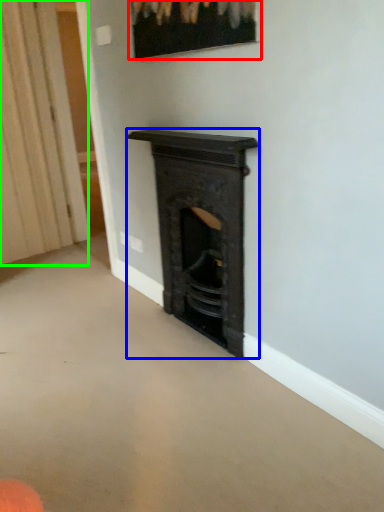
Question: Which is farther away from picture frame (highlighted by a red box)? fireplace (highlighted by a blue box) or curtain (highlighted by a green box)?

Choices:
 (A) fireplace
 (B) curtain

Answer: (B)